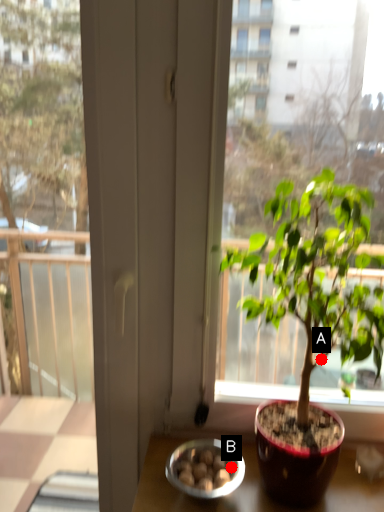
Question: Two points are circled on the image, labeled by A and B beside each circle. Among these points, which one is nearest to the camera?

Choices:
 (A) A is closer
 (B) B is closer

Answer: (A)